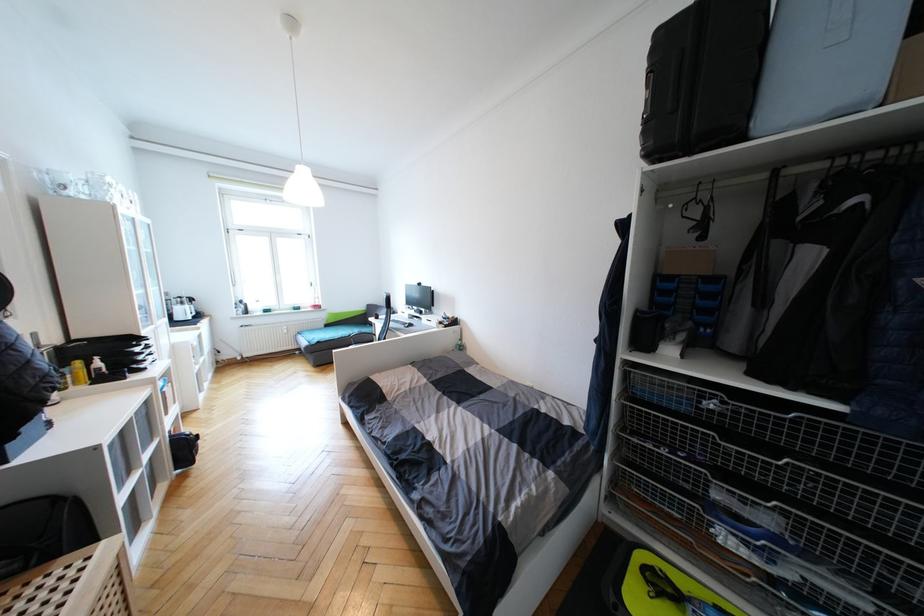
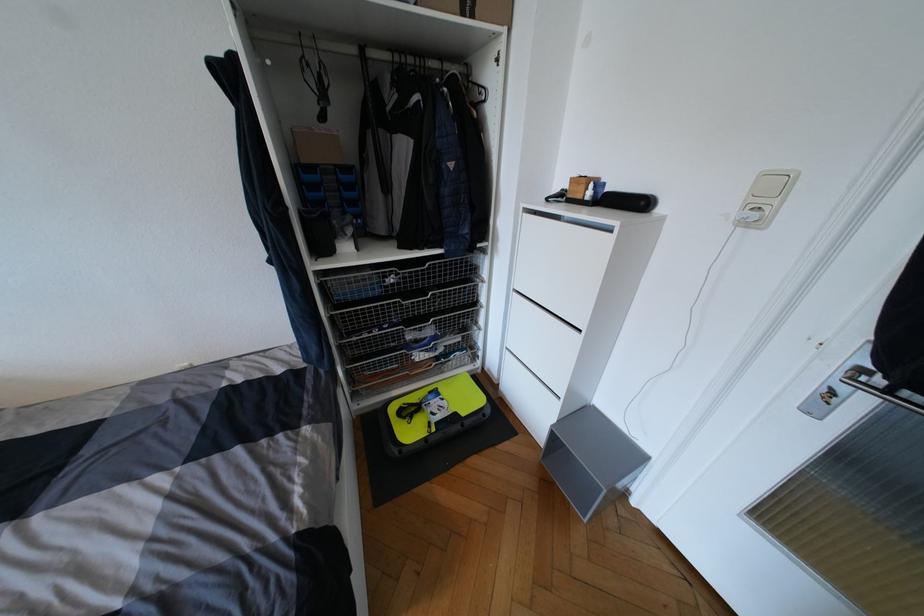
First-person continuous shooting, in which direction is the camera rotating?

The camera rotated toward right-down.